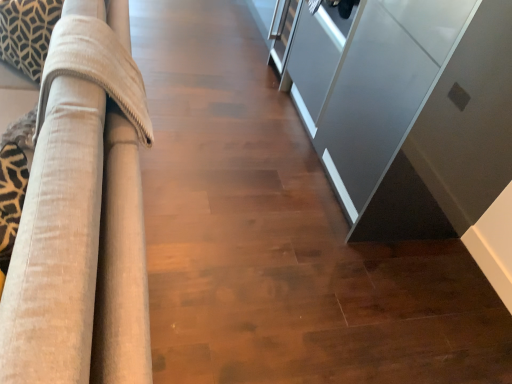
Question: From the image's perspective, would you say beige fabric couch at left is positioned over satin gray cabinet at right?

Choices:
 (A) yes
 (B) no

Answer: (A)

Question: Does beige fabric couch at left have a greater height compared to satin gray cabinet at right?

Choices:
 (A) no
 (B) yes

Answer: (A)

Question: From the image's perspective, is beige fabric couch at left located beneath satin gray cabinet at right?

Choices:
 (A) yes
 (B) no

Answer: (B)

Question: Does beige fabric couch at left appear on the right side of satin gray cabinet at right?

Choices:
 (A) yes
 (B) no

Answer: (B)

Question: From a real-world perspective, is beige fabric couch at left physically above satin gray cabinet at right?

Choices:
 (A) yes
 (B) no

Answer: (B)

Question: From a real-world perspective, is beige fabric couch at left physically located above or below satin gray cabinet at right?

Choices:
 (A) above
 (B) below

Answer: (B)

Question: Is beige fabric couch at left wider or thinner than satin gray cabinet at right?

Choices:
 (A) wide
 (B) thin

Answer: (A)

Question: In terms of size, does beige fabric couch at left appear bigger or smaller than satin gray cabinet at right?

Choices:
 (A) small
 (B) big

Answer: (B)

Question: In the image, is beige fabric couch at left on the left side or the right side of satin gray cabinet at right?

Choices:
 (A) right
 (B) left

Answer: (B)

Question: Is satin gray cabinet at right wider or thinner than beige fabric couch at left?

Choices:
 (A) thin
 (B) wide

Answer: (A)

Question: From the image's perspective, is satin gray cabinet at right positioned above or below beige fabric couch at left?

Choices:
 (A) below
 (B) above

Answer: (A)

Question: In the image, is satin gray cabinet at right positioned in front of or behind beige fabric couch at left?

Choices:
 (A) behind
 (B) front

Answer: (A)

Question: From a real-world perspective, is satin gray cabinet at right physically located above or below beige fabric couch at left?

Choices:
 (A) below
 (B) above

Answer: (B)

Question: From the image's perspective, is patterned fabric pillow at upper left located above or below beige fabric couch at left?

Choices:
 (A) below
 (B) above

Answer: (B)

Question: Is patterned fabric pillow at upper left wider or thinner than beige fabric couch at left?

Choices:
 (A) wide
 (B) thin

Answer: (B)